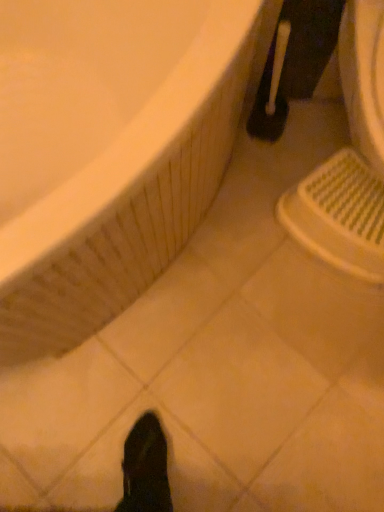
What is the approximate height of white glossy bathtub at upper left?

The height of white glossy bathtub at upper left is 24.93 inches.

Where is `black plastic toilet brush at upper right`? Image resolution: width=384 pixels, height=512 pixels. black plastic toilet brush at upper right is located at coordinates (295, 63).

You are a GUI agent. You are given a task and a screenshot of the screen. Output one action in this format:
    pyautogui.click(x=<x>, y=<y>)
    Task: Click on the white plastic sink at lower right
    This screenshot has width=384, height=512.
    Given the screenshot: What is the action you would take?
    pyautogui.click(x=349, y=160)

The width and height of the screenshot is (384, 512). What do you see at coordinates (349, 160) in the screenshot? I see `white plastic sink at lower right` at bounding box center [349, 160].

Locate an element on the screen. white glossy bathtub at upper left is located at coordinates (x=107, y=152).

From the image's perspective, which is above, white glossy bathtub at upper left or black plastic toilet brush at upper right?

black plastic toilet brush at upper right is shown above in the image.

The height and width of the screenshot is (512, 384). I want to click on bathtub on the left of the black plastic toilet brush at upper right, so click(107, 152).

Considering the relative sizes of white glossy bathtub at upper left and black plastic toilet brush at upper right in the image provided, is white glossy bathtub at upper left thinner than black plastic toilet brush at upper right?

No.

Is white glossy bathtub at upper left behind black plastic toilet brush at upper right?

No.

Is white plastic sink at lower right oriented towards black plastic toilet brush at upper right?

No, white plastic sink at lower right is not turned towards black plastic toilet brush at upper right.

Which object is further away from the camera, white plastic sink at lower right or black plastic toilet brush at upper right?

black plastic toilet brush at upper right is more distant.

Considering the relative sizes of white plastic sink at lower right and black plastic toilet brush at upper right in the image provided, is white plastic sink at lower right smaller than black plastic toilet brush at upper right?

Actually, white plastic sink at lower right might be larger than black plastic toilet brush at upper right.

Considering the relative sizes of white plastic sink at lower right and black plastic toilet brush at upper right in the image provided, is white plastic sink at lower right wider than black plastic toilet brush at upper right?

Yes, white plastic sink at lower right is wider than black plastic toilet brush at upper right.

In the scene shown: From a real-world perspective, is black plastic toilet brush at upper right physically above white glossy bathtub at upper left?

No, from a real-world perspective, black plastic toilet brush at upper right is not above white glossy bathtub at upper left.

Does black plastic toilet brush at upper right appear on the left side of white glossy bathtub at upper left?

In fact, black plastic toilet brush at upper right is to the right of white glossy bathtub at upper left.

From the image's perspective, is black plastic toilet brush at upper right located above white glossy bathtub at upper left?

Correct, black plastic toilet brush at upper right appears higher than white glossy bathtub at upper left in the image.

Considering the positions of objects black plastic toilet brush at upper right and white glossy bathtub at upper left in the image provided, who is behind, black plastic toilet brush at upper right or white glossy bathtub at upper left?

black plastic toilet brush at upper right.

Can you confirm if black plastic toilet brush at upper right is bigger than white plastic sink at lower right?

No, black plastic toilet brush at upper right is not bigger than white plastic sink at lower right.

Is black plastic toilet brush at upper right to the left of white plastic sink at lower right from the viewer's perspective?

Yes, black plastic toilet brush at upper right is to the left of white plastic sink at lower right.

Could you tell me if black plastic toilet brush at upper right is facing white plastic sink at lower right?

No, black plastic toilet brush at upper right does not turn towards white plastic sink at lower right.

Is white plastic sink at lower right aimed at white glossy bathtub at upper left?

No, white plastic sink at lower right is not oriented towards white glossy bathtub at upper left.

Can you confirm if white plastic sink at lower right is taller than white glossy bathtub at upper left?

No, white plastic sink at lower right is not taller than white glossy bathtub at upper left.

Locate an element on the screen. bathtub that appears below the white plastic sink at lower right (from the image's perspective) is located at coordinates (107, 152).

Can you confirm if white plastic sink at lower right is bigger than white glossy bathtub at upper left?

No, white plastic sink at lower right is not bigger than white glossy bathtub at upper left.

Is white glossy bathtub at upper left positioned with its back to white plastic sink at lower right?

white glossy bathtub at upper left is not turned away from white plastic sink at lower right.

Is white glossy bathtub at upper left shorter than white plastic sink at lower right?

No.

From a real-world perspective, who is located higher, white glossy bathtub at upper left or white plastic sink at lower right?

In real-world perspective, white glossy bathtub at upper left is above.

Locate an element on the screen. Image resolution: width=384 pixels, height=512 pixels. bathtub on the left of black plastic toilet brush at upper right is located at coordinates (107, 152).

Find the location of `leg behind the white plastic sink at lower right`. leg behind the white plastic sink at lower right is located at coordinates (295, 63).

When comparing their distances from white plastic sink at lower right, does black plastic toilet brush at upper right or white glossy bathtub at upper left seem further?

white glossy bathtub at upper left is further to white plastic sink at lower right.

From the picture: Which object lies further to the anchor point white glossy bathtub at upper left, white plastic sink at lower right or black plastic toilet brush at upper right?

Based on the image, black plastic toilet brush at upper right appears to be further to white glossy bathtub at upper left.

Based on their spatial positions, is white plastic sink at lower right or white glossy bathtub at upper left further from black plastic toilet brush at upper right?

white glossy bathtub at upper left.

Consider the image. Estimate the real-world distances between objects in this image. Which object is further from white glossy bathtub at upper left, black plastic toilet brush at upper right or white plastic sink at lower right?

black plastic toilet brush at upper right is positioned further to the anchor white glossy bathtub at upper left.

When comparing their distances from white plastic sink at lower right, does white glossy bathtub at upper left or black plastic toilet brush at upper right seem closer?

The object closer to white plastic sink at lower right is black plastic toilet brush at upper right.

From the image, which object appears to be farther from black plastic toilet brush at upper right, white glossy bathtub at upper left or white plastic sink at lower right?

The object further to black plastic toilet brush at upper right is white glossy bathtub at upper left.

This screenshot has height=512, width=384. Identify the location of leg located between white glossy bathtub at upper left and white plastic sink at lower right in the left-right direction. (295, 63).